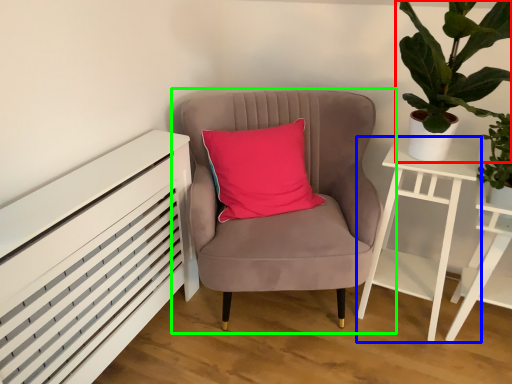
Question: Which object is positioned closest to houseplant (highlighted by a red box)? Select from nightstand (highlighted by a blue box) and chair (highlighted by a green box).

Choices:
 (A) nightstand
 (B) chair

Answer: (A)